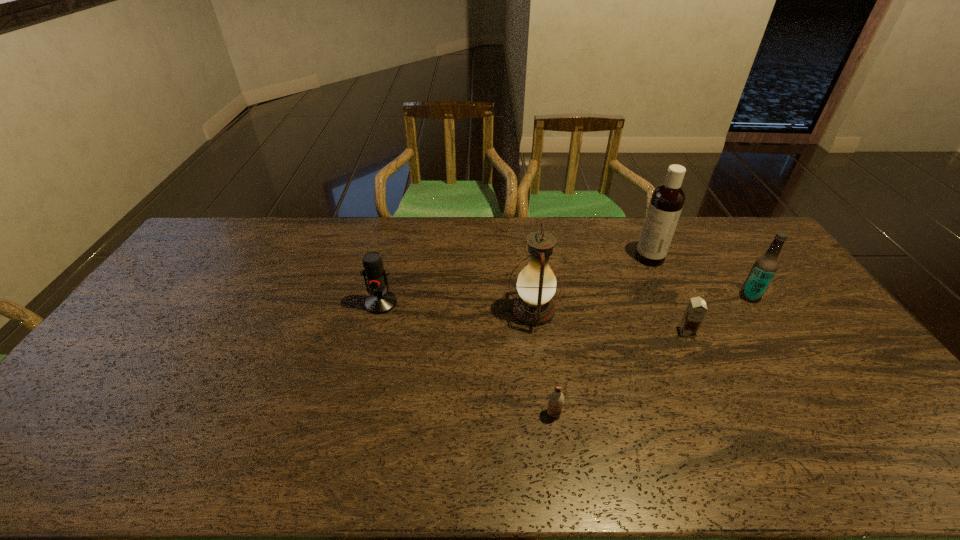
Find the location of a particular element. The height and width of the screenshot is (540, 960). dishwasher detergent is located at coordinates (x=667, y=200).

Locate an element on the screen. oil lamp is located at coordinates (536, 285).

Identify the location of beer bottle. (765, 267).

The image size is (960, 540). Identify the location of the third tallest object. (765, 267).

I want to click on the leftmost object, so click(x=380, y=301).

Find the location of a particular element. Image resolution: width=960 pixels, height=540 pixels. microphone is located at coordinates (380, 301).

Locate an element on the screen. The image size is (960, 540). the taller chocolate milk is located at coordinates (696, 309).

At what (x,y) coordinates should I click in order to perform the action: click on the right chocolate milk. Please return your answer as a coordinate pair (x, y). The height and width of the screenshot is (540, 960). Looking at the image, I should click on (696, 309).

I want to click on the shortest object, so click(x=556, y=399).

You are a GUI agent. You are given a task and a screenshot of the screen. Output one action in this format:
    pyautogui.click(x=<x>, y=<y>)
    Task: Click on the nearer chocolate milk
    This screenshot has height=540, width=960.
    Given the screenshot: What is the action you would take?
    pyautogui.click(x=556, y=399)